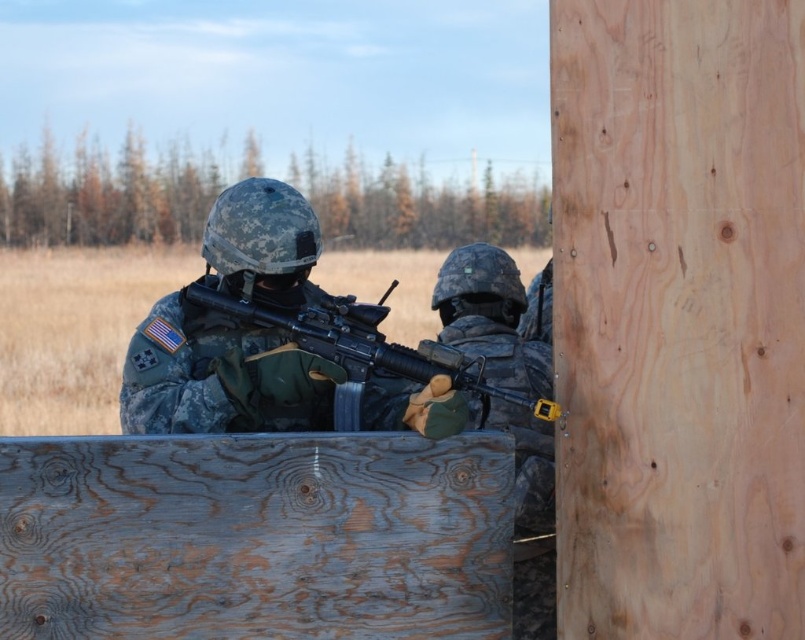
Question: From the image, what is the correct spatial relationship of camouflage fabric rifle at center in relation to matte black rifle at center?

Choices:
 (A) right
 (B) left

Answer: (B)

Question: Among these objects, which one is nearest to the camera?

Choices:
 (A) camouflage fabric rifle at center
 (B) matte black rifle at center

Answer: (A)

Question: In this image, where is camouflage fabric rifle at center located relative to matte black rifle at center?

Choices:
 (A) left
 (B) right

Answer: (A)

Question: Which object is closer to the camera taking this photo?

Choices:
 (A) camouflage fabric rifle at center
 (B) matte black rifle at center

Answer: (A)

Question: Is camouflage fabric rifle at center positioned in front of matte black rifle at center?

Choices:
 (A) no
 (B) yes

Answer: (B)